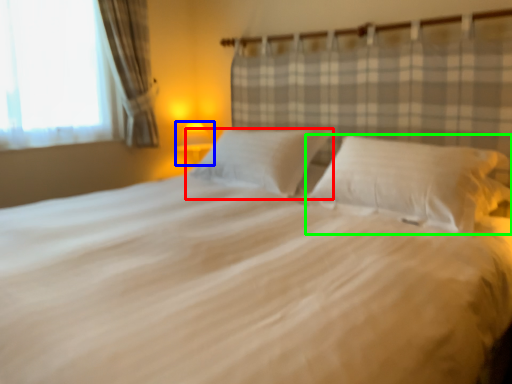
Question: Which object is positioned closest to pillow (highlighted by a red box)? Select from lamp (highlighted by a blue box) and pillow (highlighted by a green box).

Choices:
 (A) lamp
 (B) pillow

Answer: (B)